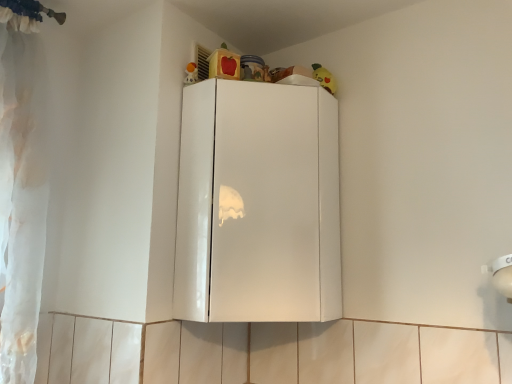
Question: Does glossy white cabinet at upper center have a greater height compared to yellow plush toy at upper right, arranged as the 2th toy when viewed from the left?

Choices:
 (A) no
 (B) yes

Answer: (B)

Question: Is glossy white cabinet at upper center to the left of yellow plush toy at upper right, which is the 1th toy from back to front, from the viewer's perspective?

Choices:
 (A) no
 (B) yes

Answer: (B)

Question: Is the position of glossy white cabinet at upper center less distant than that of yellow plush toy at upper right, which appears as the 2th toy when viewed from the front?

Choices:
 (A) yes
 (B) no

Answer: (A)

Question: From a real-world perspective, is glossy white cabinet at upper center positioned under yellow plush toy at upper right, which is the 1th toy from back to front, based on gravity?

Choices:
 (A) no
 (B) yes

Answer: (B)

Question: Is glossy white cabinet at upper center not close to yellow plush toy at upper right, which appears as the 2th toy when viewed from the front?

Choices:
 (A) yes
 (B) no

Answer: (B)

Question: Does glossy white cabinet at upper center come behind yellow plush toy at upper right, arranged as the 1th toy when viewed from the right?

Choices:
 (A) yes
 (B) no

Answer: (B)

Question: From the image's perspective, is yellow plush toy at upper right, which appears as the 2th toy when viewed from the front, below glossy white cabinet at upper center?

Choices:
 (A) no
 (B) yes

Answer: (A)

Question: Is yellow plush toy at upper right, arranged as the 1th toy when viewed from the right, looking in the opposite direction of glossy white cabinet at upper center?

Choices:
 (A) no
 (B) yes

Answer: (A)

Question: From the image's perspective, does yellow plush toy at upper right, which appears as the 2th toy when viewed from the front, appear higher than glossy white cabinet at upper center?

Choices:
 (A) no
 (B) yes

Answer: (B)

Question: Considering the relative sizes of yellow plush toy at upper right, which appears as the 2th toy when viewed from the front, and glossy white cabinet at upper center in the image provided, is yellow plush toy at upper right, which appears as the 2th toy when viewed from the front, taller than glossy white cabinet at upper center?

Choices:
 (A) no
 (B) yes

Answer: (A)

Question: Is yellow plush toy at upper right, arranged as the 2th toy when viewed from the left, touching glossy white cabinet at upper center?

Choices:
 (A) no
 (B) yes

Answer: (A)

Question: From a real-world perspective, is yellow plush toy at upper right, arranged as the 1th toy when viewed from the right, physically above glossy white cabinet at upper center?

Choices:
 (A) yes
 (B) no

Answer: (A)

Question: Is matte plastic toy at upper center, arranged as the first toy when viewed from the left, oriented away from glossy white cabinet at upper center?

Choices:
 (A) no
 (B) yes

Answer: (A)